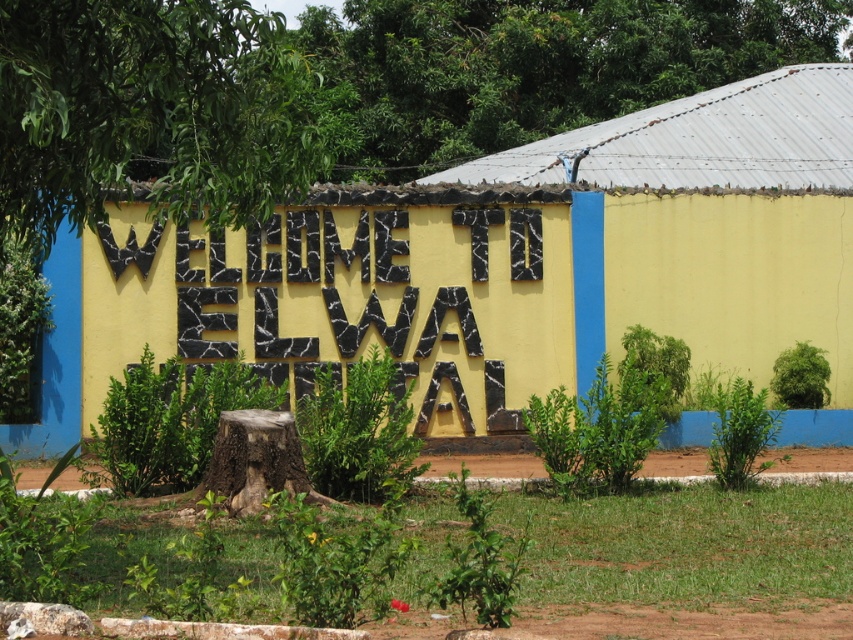
You are a painter standing in front of the yellow painted wall at center and the brown rough tree stump at center. You want to paint the wall first. Which object should you move out of the way first?

The brown rough tree stump at center is behind the yellow painted wall at center, so you should move the brown rough tree stump at center first to access the wall.

You are a gardener who wants to place a new flower pot between the black stone letters at center and the brown rough tree stump at center. According to the scene, which side of the tree stump should you place it on?

The black stone letters at center are to the right of the brown rough tree stump at center, so you should place the flower pot to the right side of the brown rough tree stump at center to position it between them.

You are a painter who needs to paint the yellow painted wall at center and the brown rough tree stump at center. Which object is higher up in the scene?

The yellow painted wall at center is located above the brown rough tree stump at center, so it is higher up in the scene.